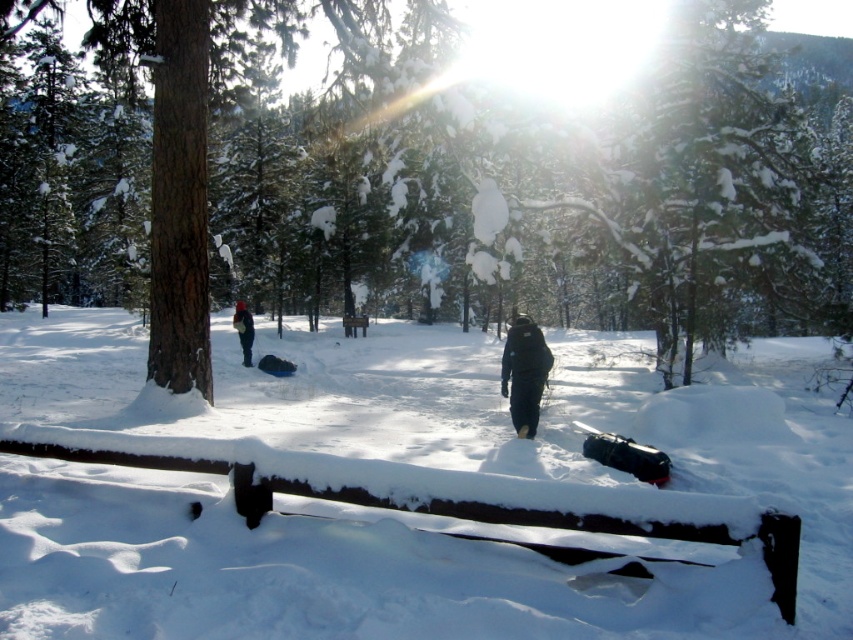
Question: Based on their relative distances, which object is farther from the black matte jacket at center?

Choices:
 (A) dark blue jacket at center
 (B) brown wood tree at center
 (C) white fluffy snow at center

Answer: (B)

Question: Which object is positioned farthest from the brown wood tree at center?

Choices:
 (A) white fluffy snow at center
 (B) dark blue jacket at center

Answer: (B)

Question: Does brown wood tree at center have a greater width compared to dark blue jacket at center?

Choices:
 (A) yes
 (B) no

Answer: (A)

Question: Which of these objects is positioned farthest from the brown wood tree at center?

Choices:
 (A) black matte jacket at center
 (B) white fluffy snow at center
 (C) dark blue jacket at center

Answer: (A)

Question: Considering the relative positions of white fluffy snow at center and black matte jacket at center in the image provided, where is white fluffy snow at center located with respect to black matte jacket at center?

Choices:
 (A) below
 (B) above

Answer: (B)

Question: Is brown wood tree at center thinner than dark blue jacket at center?

Choices:
 (A) no
 (B) yes

Answer: (A)